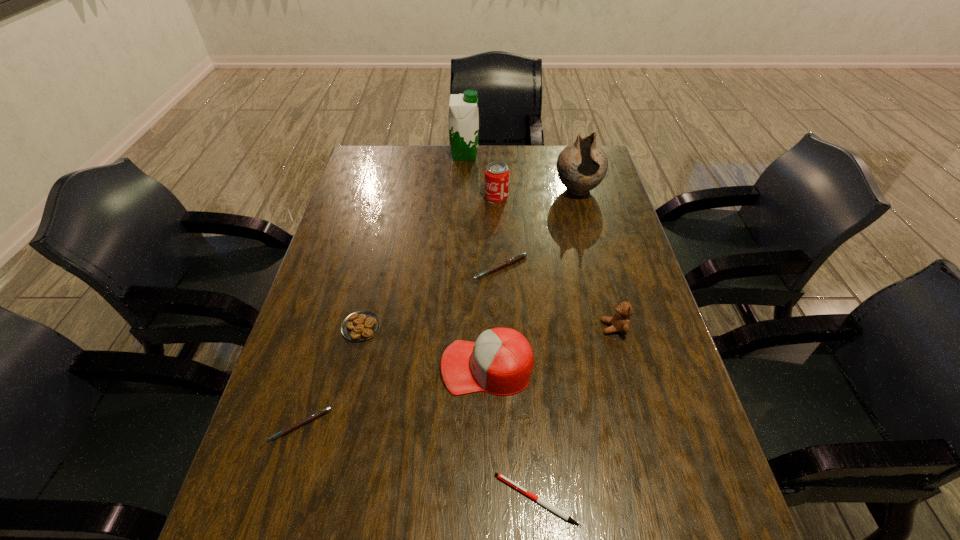
Where is `blank region between the white pen and the smaller pink pen`? The height and width of the screenshot is (540, 960). blank region between the white pen and the smaller pink pen is located at coordinates (419, 462).

Locate an element on the screen. vacant space that's between the nearest pen and the baseball cap is located at coordinates (512, 433).

I want to click on free space between the bigger pink pen and the soya milk, so click(x=483, y=211).

Locate an element on the screen. The image size is (960, 540). vacant point located between the farthest object and the leftmost pen is located at coordinates (383, 290).

Find the location of a particular element. The width and height of the screenshot is (960, 540). vacant space that is in between the left pink pen and the pottery is located at coordinates (439, 308).

What are the coordinates of `empty space that is in between the seventh shortest object and the red baseball cap` in the screenshot? It's located at (492, 282).

Where is `object that is the closest to the red can`? object that is the closest to the red can is located at coordinates (581, 166).

Identify which object is the nearest to the farthest object. Please provide its 2D coordinates. Your answer should be formatted as a tuple, i.e. [(x, y)], where the tuple contains the x and y coordinates of a point satisfying the conditions above.

[(496, 175)]

I want to click on pen that is the second closest to the brown teddy bear, so click(x=539, y=500).

Point out which pen is positioned as the nearest to the sixth tallest object. Please provide its 2D coordinates. Your answer should be formatted as a tuple, i.e. [(x, y)], where the tuple contains the x and y coordinates of a point satisfying the conditions above.

[(312, 417)]